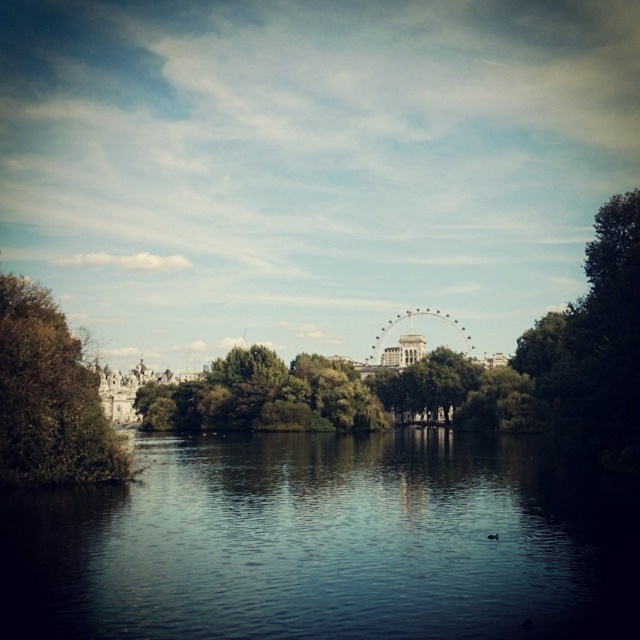
Can you confirm if green leafy tree at right is positioned to the left of green leafy tree at center?

Incorrect, green leafy tree at right is not on the left side of green leafy tree at center.

Does point (570, 385) come in front of point (208, 387)?

Yes, point (570, 385) is closer to viewer.

What do you see at coordinates (593, 339) in the screenshot? I see `green leafy tree at right` at bounding box center [593, 339].

The width and height of the screenshot is (640, 640). Find the location of `green leafy tree at right`. green leafy tree at right is located at coordinates (593, 339).

Between green leafy tree at left and metallic ferris wheel at center, which one is positioned lower?

green leafy tree at left is below.

Can you confirm if green leafy tree at left is positioned above metallic ferris wheel at center?

Actually, green leafy tree at left is below metallic ferris wheel at center.

Between point (49, 355) and point (374, 353), which one is positioned in front?

Positioned in front is point (49, 355).

Where is `green leafy tree at left`? The image size is (640, 640). green leafy tree at left is located at coordinates (49, 397).

Does dark reflective water at center have a lesser width compared to green leafy tree at center?

Incorrect, dark reflective water at center's width is not less than green leafy tree at center's.

In the scene shown: Between dark reflective water at center and green leafy tree at center, which one has more height?

green leafy tree at center is taller.

Who is more distant from viewer, (432, 577) or (138, 401)?

The point (138, 401) is behind.

Find the location of a particular element. The width and height of the screenshot is (640, 640). dark reflective water at center is located at coordinates coord(326,544).